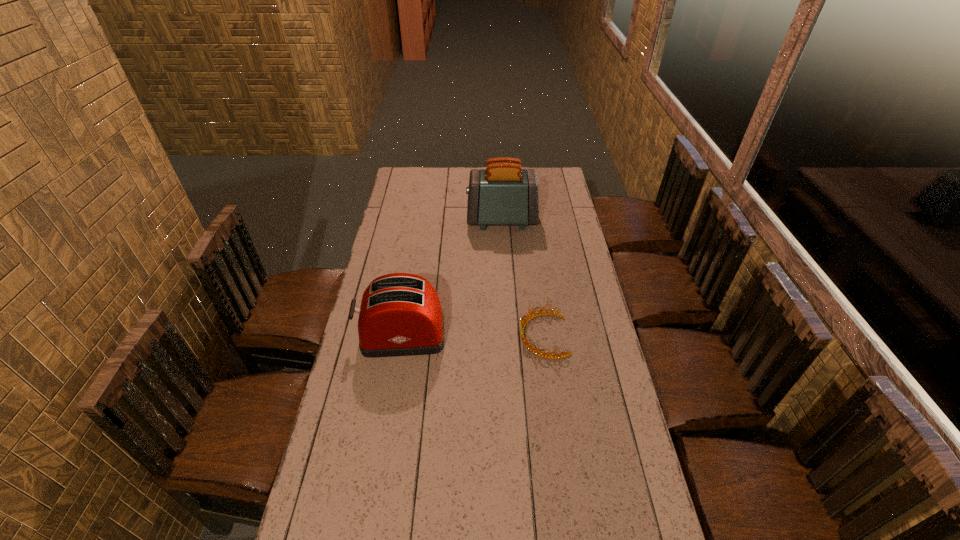
Where is `free spot located on the front-facing side of the tiara`? free spot located on the front-facing side of the tiara is located at coordinates (498, 336).

I want to click on vacant space positioned 0.080m on the front-facing side of the tiara, so click(x=496, y=336).

This screenshot has height=540, width=960. Identify the location of object located in the left edge section of the desktop. pos(400,314).

Locate an element on the screen. object present at the right edge is located at coordinates (538, 352).

The width and height of the screenshot is (960, 540). In the image, there is a desktop. Find the location of `free space at the far edge`. free space at the far edge is located at coordinates (462, 184).

Locate an element on the screen. free space at the left edge is located at coordinates pos(396,265).

This screenshot has height=540, width=960. In order to click on vacant space at the right edge in this screenshot , I will do `click(562, 206)`.

I want to click on unoccupied position between the tiara and the tallest object, so click(x=522, y=278).

The width and height of the screenshot is (960, 540). I want to click on vacant point located between the farther toaster and the shortest object, so click(522, 278).

This screenshot has height=540, width=960. I want to click on vacant area that lies between the shortest object and the right toaster, so click(x=522, y=278).